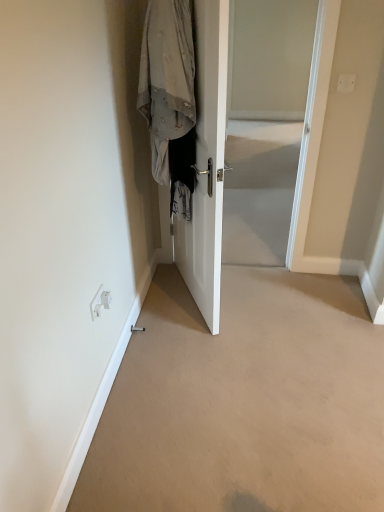
Question: Does white glossy door at center appear on the right side of white plastic electric outlet at lower left?

Choices:
 (A) yes
 (B) no

Answer: (A)

Question: From a real-world perspective, is white glossy door at center located beneath white plastic electric outlet at lower left?

Choices:
 (A) yes
 (B) no

Answer: (B)

Question: Can we say white glossy door at center lies outside white plastic electric outlet at lower left?

Choices:
 (A) yes
 (B) no

Answer: (A)

Question: Are white glossy door at center and white plastic electric outlet at lower left far apart?

Choices:
 (A) yes
 (B) no

Answer: (B)

Question: From the image's perspective, is white glossy door at center below white plastic electric outlet at lower left?

Choices:
 (A) yes
 (B) no

Answer: (B)

Question: Could white plastic electric outlet at lower left be considered to be inside white glossy door at center?

Choices:
 (A) no
 (B) yes

Answer: (A)

Question: From the image's perspective, would you say light gray fabric coat at center is positioned over white glossy door at center?

Choices:
 (A) yes
 (B) no

Answer: (A)

Question: Is light gray fabric coat at center at the right side of white glossy door at center?

Choices:
 (A) yes
 (B) no

Answer: (B)

Question: From the image's perspective, does light gray fabric coat at center appear lower than white glossy door at center?

Choices:
 (A) no
 (B) yes

Answer: (A)

Question: Can you confirm if light gray fabric coat at center is smaller than white glossy door at center?

Choices:
 (A) yes
 (B) no

Answer: (A)

Question: Is light gray fabric coat at center not close to white glossy door at center?

Choices:
 (A) no
 (B) yes

Answer: (A)

Question: Is light gray fabric coat at center at the left side of white glossy door at center?

Choices:
 (A) no
 (B) yes

Answer: (B)

Question: From the image's perspective, is white glossy door at center on beige carpet at lower center?

Choices:
 (A) no
 (B) yes

Answer: (B)